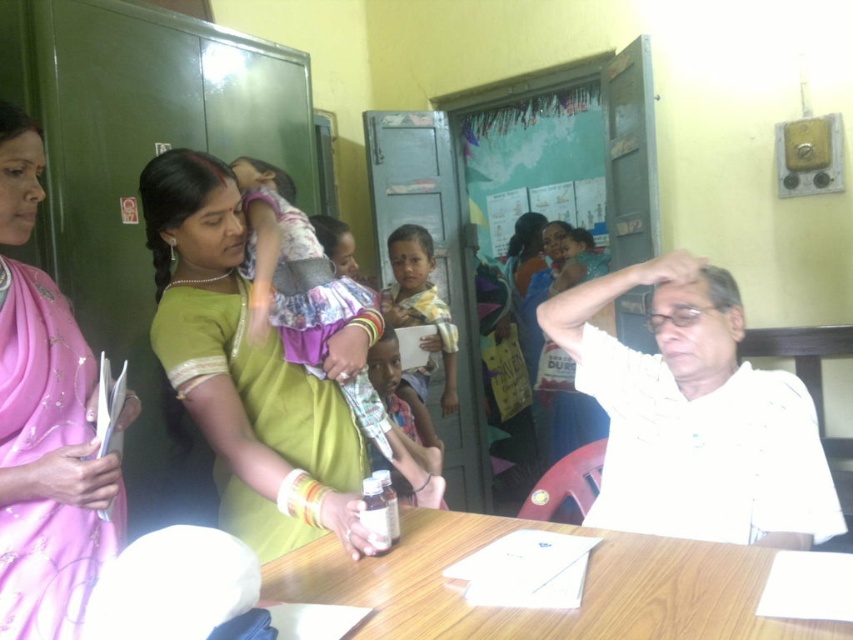
Question: Which of the following is the farthest from the observer?

Choices:
 (A) green silk saree at center
 (B) matte plastic bottle at center
 (C) pink satin saree at left

Answer: (B)

Question: Which point is farther to the camera?

Choices:
 (A) wooden table at center
 (B) light purple fabric dress at center
 (C) pink satin saree at left

Answer: (B)

Question: Can you confirm if wooden table at center is thinner than yellow clothed child at center?

Choices:
 (A) no
 (B) yes

Answer: (A)

Question: Is light purple fabric dress at center smaller than yellow clothed child at center?

Choices:
 (A) no
 (B) yes

Answer: (A)

Question: Does wooden table at center lie behind yellow clothed child at center?

Choices:
 (A) no
 (B) yes

Answer: (A)

Question: Which of the following is the farthest from the observer?

Choices:
 (A) wooden table at center
 (B) green silk saree at center
 (C) yellow clothed child at center
 (D) light purple fabric dress at center

Answer: (C)